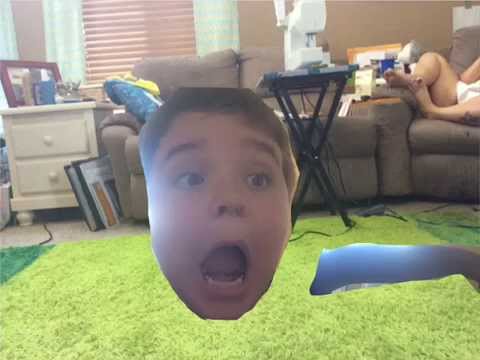
You are a GUI agent. You are given a task and a screenshot of the screen. Output one action in this format:
    pyautogui.click(x=<x>, y=<y>)
    Task: Click on the tv tray
    This screenshot has width=480, height=360.
    Given the screenshot: What is the action you would take?
    pyautogui.click(x=292, y=73)